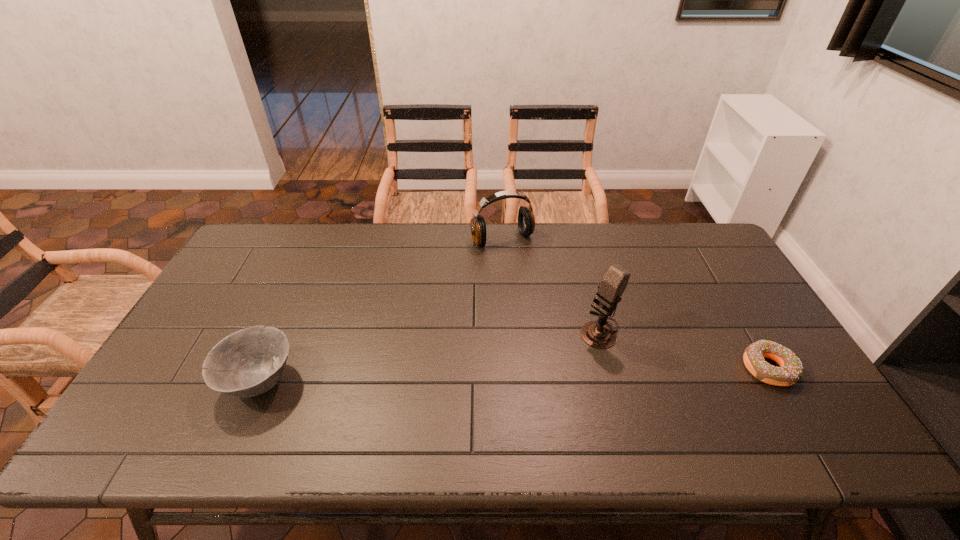
Where is `vacant space located 0.200m on the front-facing side of the second object from right to left`? This screenshot has width=960, height=540. vacant space located 0.200m on the front-facing side of the second object from right to left is located at coordinates (532, 377).

Where is `vacant space situated 0.210m on the front-facing side of the second object from right to left`? Image resolution: width=960 pixels, height=540 pixels. vacant space situated 0.210m on the front-facing side of the second object from right to left is located at coordinates (529, 380).

You are a GUI agent. You are given a task and a screenshot of the screen. Output one action in this format:
    pyautogui.click(x=<x>, y=<y>)
    Task: Click on the blank space located 0.090m on the front-facing side of the second object from right to left
    The width and height of the screenshot is (960, 540).
    Given the screenshot: What is the action you would take?
    pyautogui.click(x=563, y=357)

What are the coordinates of `free space located 0.100m on the ear cups of the third shortest object` in the screenshot? It's located at (525, 269).

Locate an element on the screen. The width and height of the screenshot is (960, 540). free spot located on the ear cups of the third shortest object is located at coordinates (528, 273).

The width and height of the screenshot is (960, 540). Find the location of `vacant space situated on the ear cups of the third shortest object`. vacant space situated on the ear cups of the third shortest object is located at coordinates coord(547,302).

Find the location of a particular element. object at the far edge is located at coordinates (526, 222).

The width and height of the screenshot is (960, 540). Find the location of `bowl positioned at the near edge`. bowl positioned at the near edge is located at coordinates (249, 362).

The image size is (960, 540). Identify the location of doughnut that is positioned at the near edge. (790, 371).

I want to click on object that is at the right edge, so click(x=790, y=371).